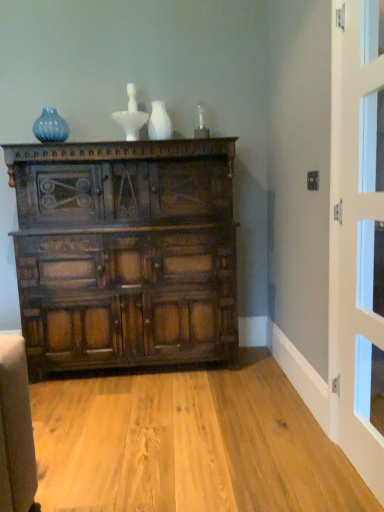
Question: Is white glossy door at right at the left side of matte blue glass vase at upper left, the second vase viewed from the front?

Choices:
 (A) no
 (B) yes

Answer: (A)

Question: Is there a large distance between white glossy door at right and matte blue glass vase at upper left, which is the second vase in right-to-left order?

Choices:
 (A) yes
 (B) no

Answer: (A)

Question: Is white glossy door at right taller than matte blue glass vase at upper left, placed as the 1th vase when sorted from left to right?

Choices:
 (A) no
 (B) yes

Answer: (B)

Question: Is matte blue glass vase at upper left, the second vase viewed from the front, inside white glossy door at right?

Choices:
 (A) no
 (B) yes

Answer: (A)

Question: Is white glossy door at right further to camera compared to matte blue glass vase at upper left, which is the second vase in right-to-left order?

Choices:
 (A) yes
 (B) no

Answer: (B)

Question: Looking at their shapes, would you say white glossy vase at upper center, the first vase positioned from the front, is wider or thinner than matte blue glass vase at upper left, marked as the first vase in a back-to-front arrangement?

Choices:
 (A) wide
 (B) thin

Answer: (A)

Question: Is point (153, 134) closer or farther from the camera than point (56, 138)?

Choices:
 (A) farther
 (B) closer

Answer: (A)

Question: Would you say white glossy vase at upper center, the first vase positioned from the front, is to the left or to the right of matte blue glass vase at upper left, which is the second vase in right-to-left order, in the picture?

Choices:
 (A) left
 (B) right

Answer: (B)

Question: From the image's perspective, is white glossy vase at upper center, the first vase positioned from the right, above or below matte blue glass vase at upper left, placed as the 1th vase when sorted from left to right?

Choices:
 (A) above
 (B) below

Answer: (B)

Question: From the image's perspective, is matte blue glass vase at upper left, placed as the 1th vase when sorted from left to right, above or below dark brown wood chest of drawers at center?

Choices:
 (A) above
 (B) below

Answer: (A)

Question: In the image, is matte blue glass vase at upper left, which is the second vase in right-to-left order, on the left side or the right side of dark brown wood chest of drawers at center?

Choices:
 (A) left
 (B) right

Answer: (A)

Question: Relative to dark brown wood chest of drawers at center, is matte blue glass vase at upper left, marked as the first vase in a back-to-front arrangement, in front or behind?

Choices:
 (A) front
 (B) behind

Answer: (B)

Question: In terms of height, does matte blue glass vase at upper left, placed as the 1th vase when sorted from left to right, look taller or shorter compared to dark brown wood chest of drawers at center?

Choices:
 (A) tall
 (B) short

Answer: (B)

Question: Visually, is dark brown wood chest of drawers at center positioned to the left or to the right of white glossy door at right?

Choices:
 (A) left
 (B) right

Answer: (A)

Question: From a real-world perspective, relative to white glossy door at right, is dark brown wood chest of drawers at center vertically above or below?

Choices:
 (A) above
 (B) below

Answer: (B)